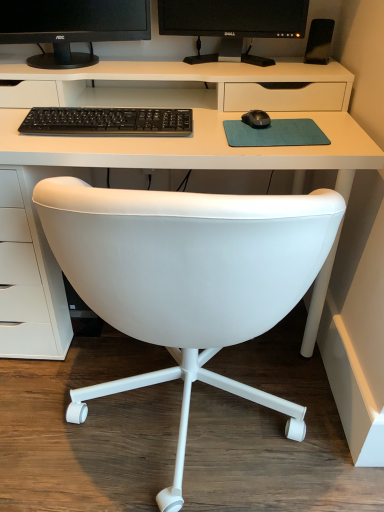
I want to click on vacant space underneath black matte monitor at upper center, the first computer monitor viewed from the left (from a real-world perspective), so click(72, 62).